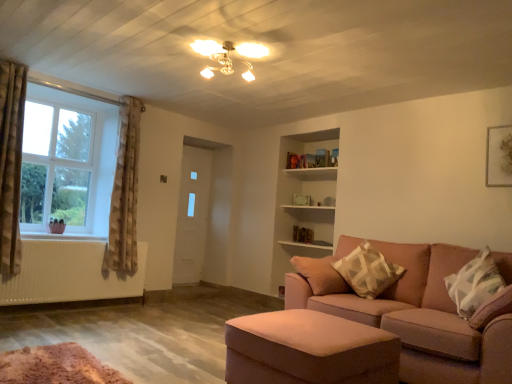
What do you see at coordinates (11, 162) in the screenshot?
I see `brown textured curtain at left` at bounding box center [11, 162].

Locate an element on the screen. brown textured curtain at left is located at coordinates (11, 162).

Locate an element on the screen. The image size is (512, 384). brown textured curtain at left is located at coordinates (11, 162).